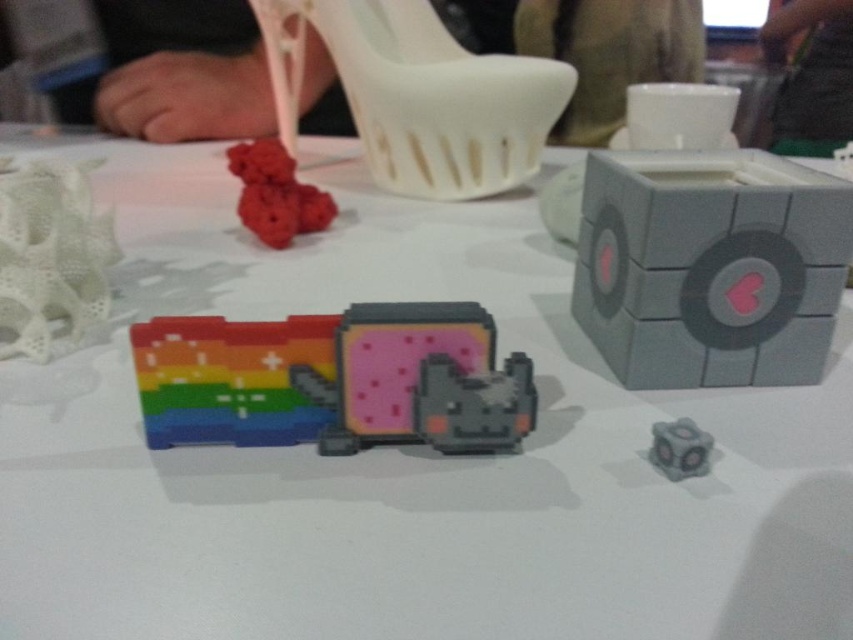
Question: Which object is the farthest from the white matte shoe at upper center?

Choices:
 (A) gray matte cube at center right
 (B) pixelated plastic toy at center
 (C) gray matte cube at lower right

Answer: (C)

Question: From the image, what is the correct spatial relationship of gray matte cube at center right in relation to rubber-like red cube at upper center?

Choices:
 (A) above
 (B) below

Answer: (B)

Question: Which object appears closest to the camera in this image?

Choices:
 (A) gray matte cube at lower right
 (B) gray matte cube at center right
 (C) rubber-like red cube at upper center
 (D) white matte sculpture at left

Answer: (A)

Question: Does white matte shoe at upper center have a larger size compared to white matte sculpture at left?

Choices:
 (A) no
 (B) yes

Answer: (B)

Question: Where is pixelated plastic toy at center located in relation to white matte shoe at upper center in the image?

Choices:
 (A) right
 (B) left

Answer: (B)

Question: Which object is closer to the camera taking this photo?

Choices:
 (A) gray matte cube at center right
 (B) gray matte cube at lower right
 (C) white matte sculpture at left
 (D) white matte shoe at upper center

Answer: (B)